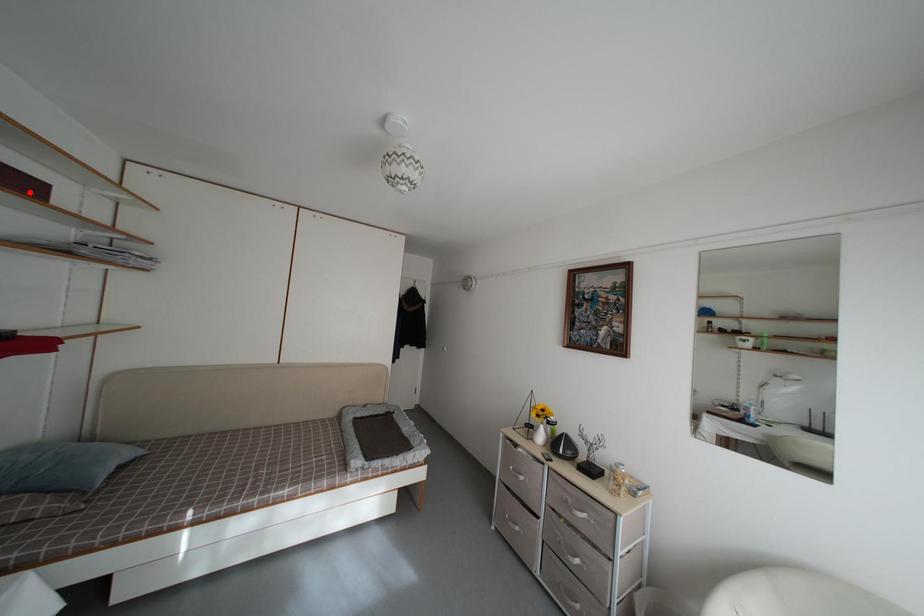
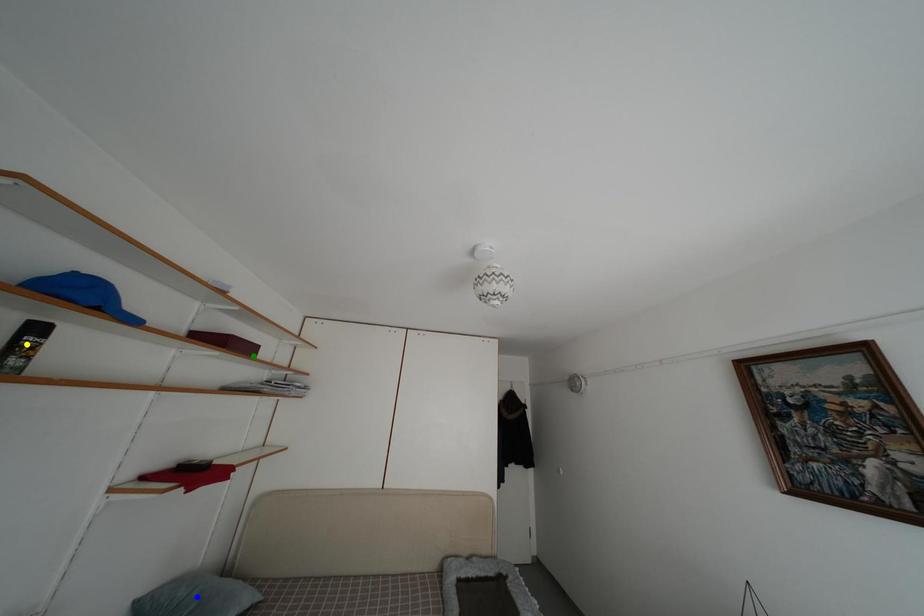
Question: I am providing you with two images of the same scene from different viewpoints. A red point is marked on the first image. You are given multiple points on the second image. In image 2, which mark is for the same physical point as the one in image 1?

Choices:
 (A) blue point
 (B) yellow point
 (C) green point

Answer: (C)